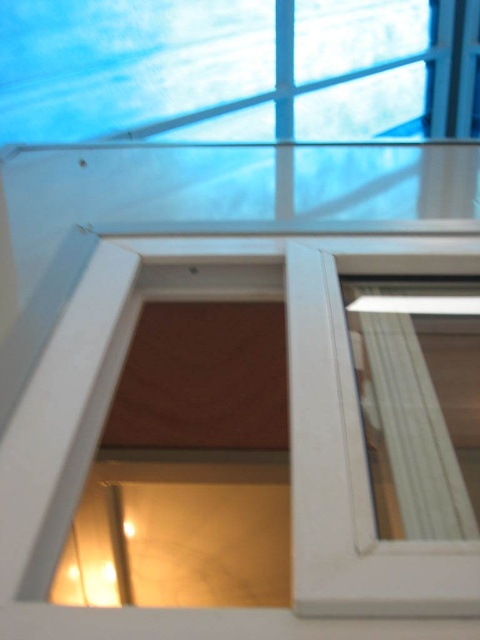
Question: Can you confirm if white matte window frame at center is bigger than clear glass window at center?

Choices:
 (A) yes
 (B) no

Answer: (A)

Question: Which point is closer to the camera?

Choices:
 (A) (475, 307)
 (B) (79, 321)

Answer: (B)

Question: Among these objects, which one is nearest to the camera?

Choices:
 (A) clear glass window at center
 (B) white matte window frame at center

Answer: (B)

Question: Is white matte window frame at center thinner than clear glass window at center?

Choices:
 (A) yes
 (B) no

Answer: (B)

Question: Which of the following is the closest to the observer?

Choices:
 (A) click(x=325, y=557)
 (B) click(x=436, y=356)

Answer: (A)

Question: Is white matte window frame at center bigger than clear glass window at center?

Choices:
 (A) no
 (B) yes

Answer: (B)